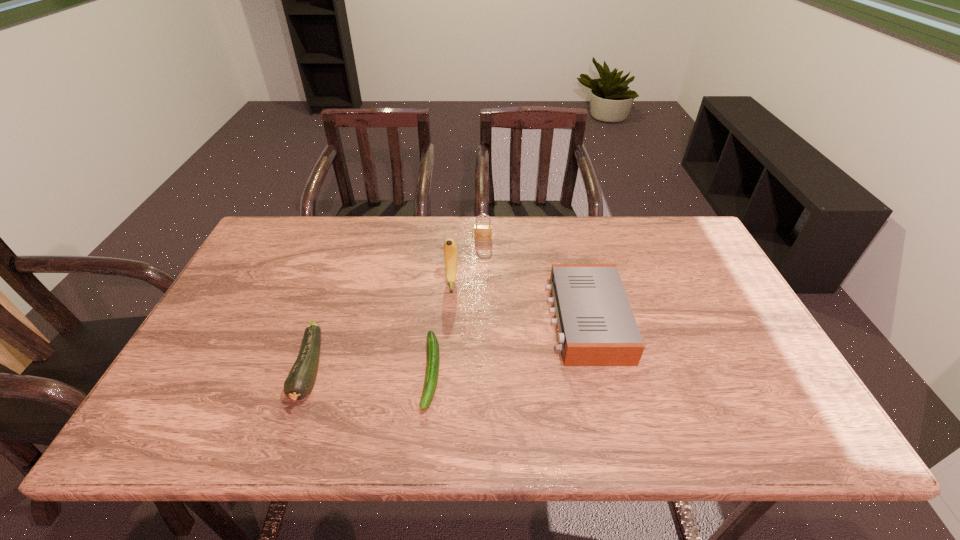
The height and width of the screenshot is (540, 960). I want to click on blank space at the near left corner of the desktop, so click(150, 420).

Image resolution: width=960 pixels, height=540 pixels. In order to click on free area in between the taller zucchini and the fourth shortest object in this screenshot , I will do `click(396, 304)`.

You are a GUI agent. You are given a task and a screenshot of the screen. Output one action in this format:
    pyautogui.click(x=<x>, y=<y>)
    Task: Click on the unoccupied area between the fourth object from left to right and the taller zucchini
    Image resolution: width=960 pixels, height=540 pixels.
    Given the screenshot: What is the action you would take?
    pyautogui.click(x=396, y=304)

The height and width of the screenshot is (540, 960). I want to click on free space that is in between the leftmost object and the rightmost object, so click(448, 345).

Where is `vacant area that lies between the radio receiver and the shortest object`? The image size is (960, 540). vacant area that lies between the radio receiver and the shortest object is located at coordinates (509, 346).

Locate an element on the screen. free space between the farthest object and the tallest object is located at coordinates (468, 260).

What are the coordinates of `free space between the second object from right to left and the radio receiver` in the screenshot? It's located at (535, 280).

What are the coordinates of `vacant area that lies between the shorter zucchini and the taller zucchini` in the screenshot? It's located at (371, 371).

Find the location of `vacant space that is in between the rightmost object and the tallest object`. vacant space that is in between the rightmost object and the tallest object is located at coordinates (519, 301).

Where is `empty space that is in between the banana and the farthest object`? empty space that is in between the banana and the farthest object is located at coordinates (468, 260).